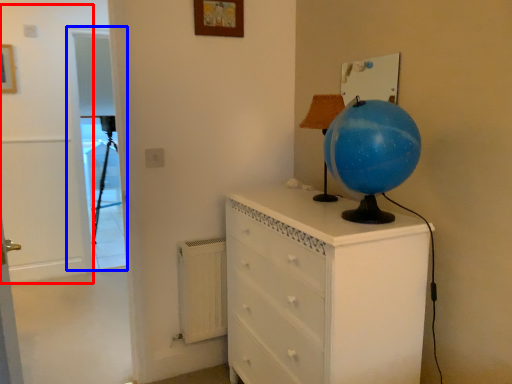
Question: Which point is closer to the camera, door (highlighted by a red box) or screen door (highlighted by a blue box)?

Choices:
 (A) door
 (B) screen door

Answer: (A)